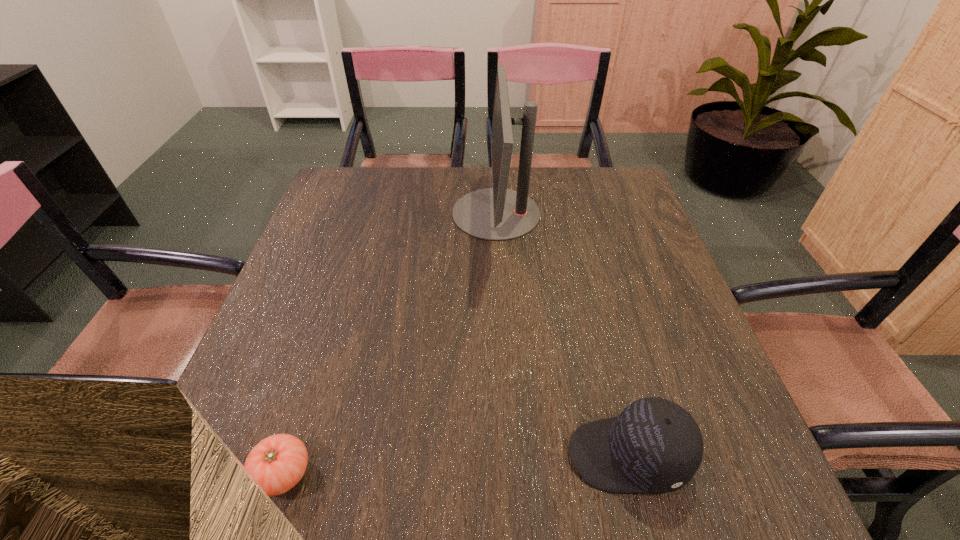
At what (x,y) coordinates should I click in order to perform the action: click on free space located at the front of the second tallest object where the brim is located. Please return your answer as a coordinate pair (x, y). This screenshot has width=960, height=540. Looking at the image, I should click on (450, 455).

Image resolution: width=960 pixels, height=540 pixels. In order to click on vacant space located on the right of the tomato in this screenshot , I will do `click(471, 473)`.

You are a GUI agent. You are given a task and a screenshot of the screen. Output one action in this format:
    pyautogui.click(x=<x>, y=<y>)
    Task: Click on the object positioned at the far edge
    The width and height of the screenshot is (960, 540).
    Given the screenshot: What is the action you would take?
    pyautogui.click(x=497, y=214)

Locate an element on the screen. The width and height of the screenshot is (960, 540). baseball cap positioned at the near edge is located at coordinates (654, 445).

What are the coordinates of `tomato that is at the near edge` in the screenshot? It's located at (277, 463).

This screenshot has width=960, height=540. I want to click on object that is at the left edge, so click(x=277, y=463).

This screenshot has height=540, width=960. I want to click on object at the right edge, so click(654, 445).

Image resolution: width=960 pixels, height=540 pixels. Identify the location of object that is at the near left corner. (277, 463).

Locate an element on the screen. This screenshot has height=540, width=960. object at the near right corner is located at coordinates (654, 445).

In the image, there is a desktop. Where is `vacant space at the far edge`? This screenshot has height=540, width=960. vacant space at the far edge is located at coordinates (429, 168).